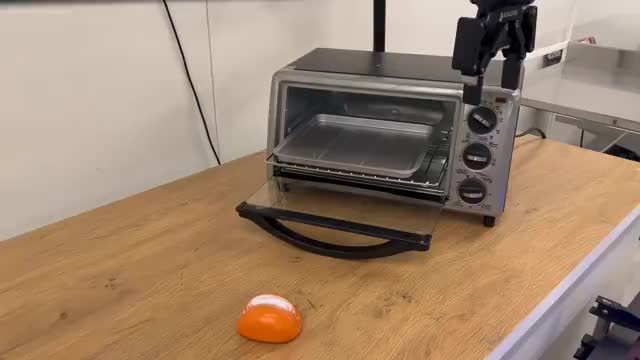
I want to click on walls, so (136, 53), (617, 15).